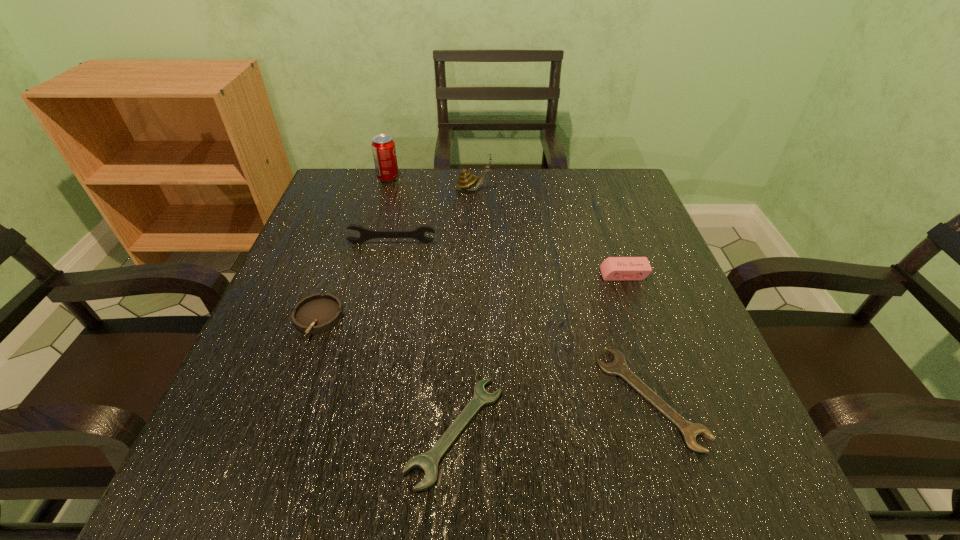
Where is `vacant area situated on the face of the snail`? vacant area situated on the face of the snail is located at coordinates (553, 189).

Image resolution: width=960 pixels, height=540 pixels. In order to click on free space located on the open ends of the third tallest object in this screenshot , I will do coord(384,278).

Locate an element on the screen. The width and height of the screenshot is (960, 540). vacant region located 0.260m on the front of the eraser is located at coordinates (665, 392).

This screenshot has height=540, width=960. Identify the location of blank area located 0.210m on the back of the third nearest object. (348, 233).

Where is `vacant space located 0.240m on the left of the rightmost wrench`? The height and width of the screenshot is (540, 960). vacant space located 0.240m on the left of the rightmost wrench is located at coordinates (453, 397).

Locate an element on the screen. soda located in the far edge section of the desktop is located at coordinates tap(383, 147).

Image resolution: width=960 pixels, height=540 pixels. Identify the location of snail that is at the far edge. (466, 181).

What are the coordinates of `soda that is at the left edge` in the screenshot? It's located at (383, 147).

This screenshot has height=540, width=960. Identify the location of wrench positioned at the left edge. (365, 234).

At what (x,y) coordinates should I click in order to perform the action: click on ashtray that is positioned at the left edge. Please return your answer as a coordinate pair (x, y). The image size is (960, 540). Looking at the image, I should click on (317, 313).